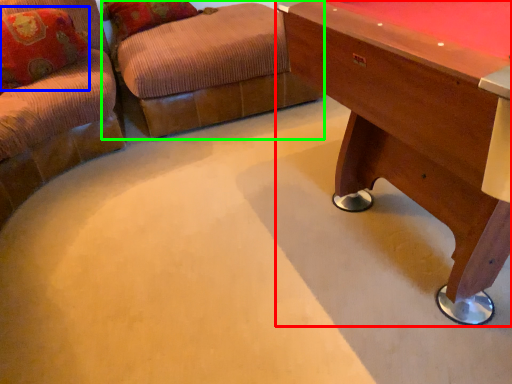
Question: Based on their relative distances, which object is nearer to table (highlighted by a red box)? Choose from pillow (highlighted by a blue box) and swivel chair (highlighted by a green box).

Choices:
 (A) pillow
 (B) swivel chair

Answer: (B)